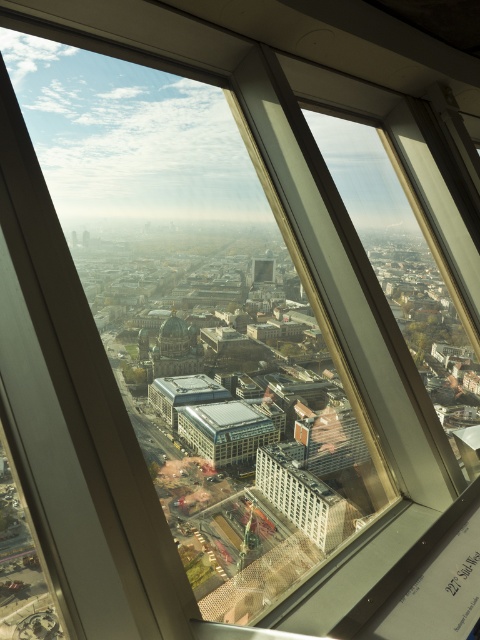
You are an architect analyzing the urban layout. You observe the white concrete building at center and the matte glass building at center from your high vantage point. Which of these two buildings has a narrower structure?

The white concrete building at center has a lesser width compared to the matte glass building at center, so it is narrower.

You are an architect reviewing blueprints for a new skyscraper. You notice two buildings in the proposed design area from the high rise observation deck. The white concrete building at center and the matte glass building at center. Which building would require less construction materials based on their sizes?

The white concrete building at center has a smaller size compared to the matte glass building at center, so it would require less construction materials.